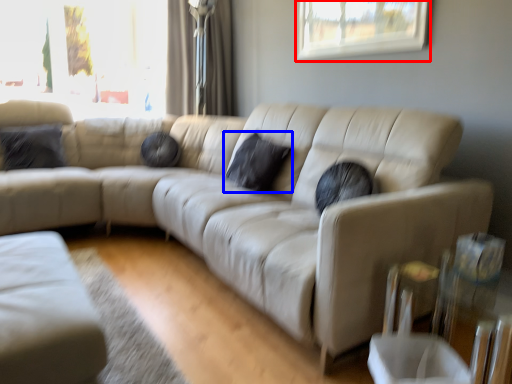
Question: Which object is further to the camera taking this photo, window (highlighted by a red box) or pillow (highlighted by a blue box)?

Choices:
 (A) window
 (B) pillow

Answer: (B)